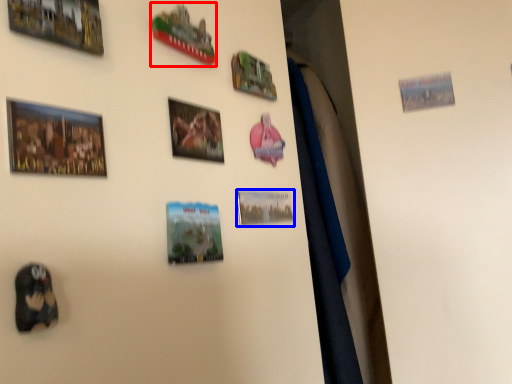
Question: Which of the following is the closest to the observer, picture frame (highlighted by a red box) or picture frame (highlighted by a blue box)?

Choices:
 (A) picture frame
 (B) picture frame

Answer: (A)